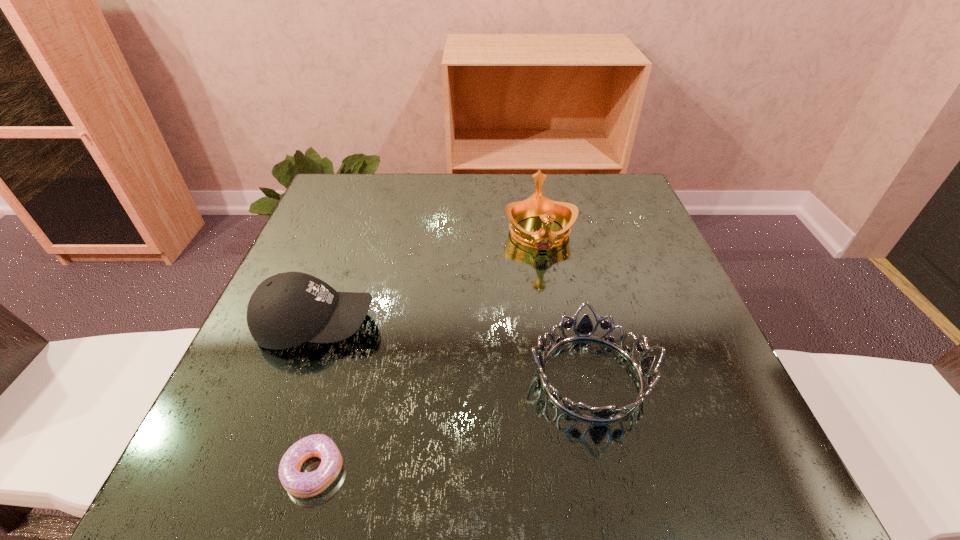
Image resolution: width=960 pixels, height=540 pixels. I want to click on free space between the baseball cap and the nearest object, so click(315, 397).

Identify the location of free space between the shortest object and the baseball cap. (315, 397).

Locate an element on the screen. free space between the shortest object and the third tallest object is located at coordinates (453, 423).

Find the location of a particular element. The height and width of the screenshot is (540, 960). unoccupied area between the doughnut and the shorter tiara is located at coordinates 453,423.

Locate an element on the screen. This screenshot has width=960, height=540. empty location between the nearer tiara and the nearest object is located at coordinates (453, 423).

Image resolution: width=960 pixels, height=540 pixels. I want to click on vacant space that's between the farthest object and the nearest object, so [427, 351].

Where is `the third closest object to the taller tiara`? The height and width of the screenshot is (540, 960). the third closest object to the taller tiara is located at coordinates (303, 485).

Choose which object is the third nearest neighbor to the doughnut. Please provide its 2D coordinates. Your answer should be formatted as a tuple, i.e. [(x, y)], where the tuple contains the x and y coordinates of a point satisfying the conditions above.

[(565, 214)]

Locate an element on the screen. The height and width of the screenshot is (540, 960). vacant point that satisfies the following two spatial constraints: 1. at the front emblem of the farther tiara; 2. on the front-facing side of the baseball cap is located at coordinates pos(555,325).

This screenshot has height=540, width=960. I want to click on free spot that satisfies the following two spatial constraints: 1. on the front-facing side of the doughnut; 2. on the right side of the baseball cap, so click(263, 470).